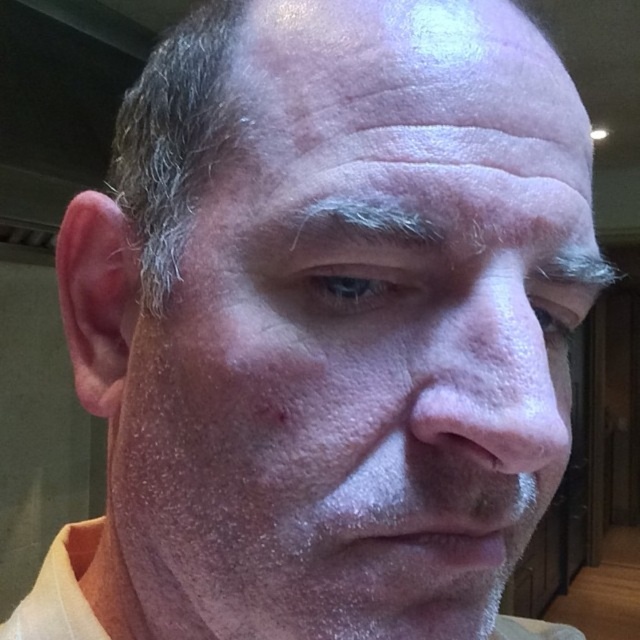
Between smooth skin nose at center and yellow cotton shirt at lower center, which one is positioned lower?

yellow cotton shirt at lower center is lower down.

Is smooth skin nose at center taller than yellow cotton shirt at lower center?

No, smooth skin nose at center is not taller than yellow cotton shirt at lower center.

Where is `smooth skin nose at center`? Image resolution: width=640 pixels, height=640 pixels. smooth skin nose at center is located at coordinates (499, 380).

Does smooth skin at upper center have a larger size compared to smooth skin nose at center?

Yes, smooth skin at upper center is bigger than smooth skin nose at center.

This screenshot has height=640, width=640. I want to click on smooth skin at upper center, so click(404, 68).

Does point (458, 93) come closer to viewer compared to point (492, 301)?

No, it is behind (492, 301).

Find the location of a particular element. This screenshot has width=640, height=640. smooth skin at upper center is located at coordinates (404, 68).

Which of these two, smooth skin at upper center or yellow cotton shirt at lower center, stands shorter?

Standing shorter between the two is smooth skin at upper center.

Is smooth skin at upper center above yellow cotton shirt at lower center?

Yes.

Does point (492, 26) come in front of point (60, 572)?

Yes, it is.

Identify the location of smooth skin at upper center. (404, 68).